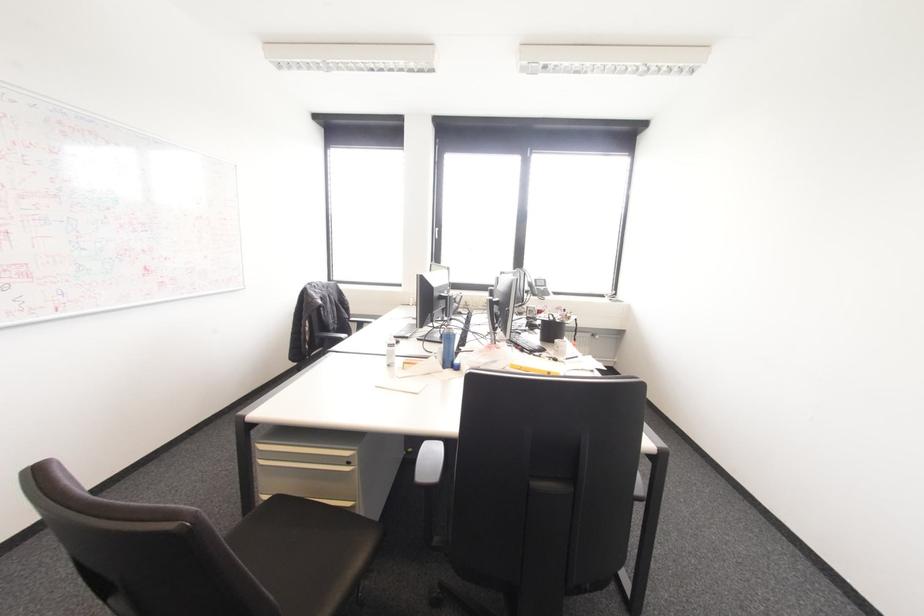
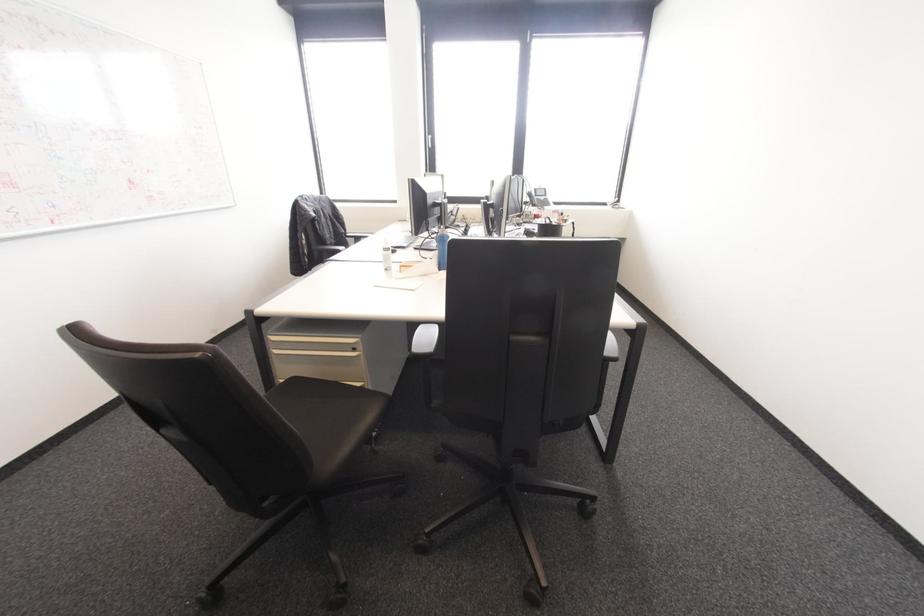
Locate, in the second image, the point that corresponds to [444,367] in the first image.

(440, 270)